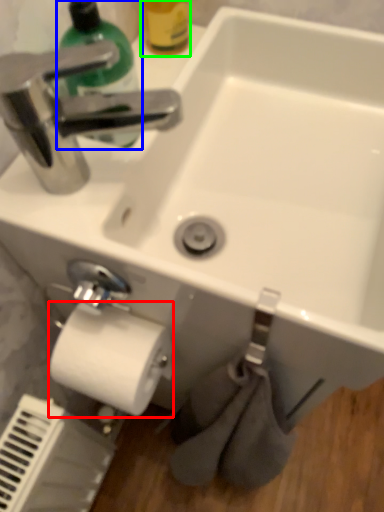
Question: Considering the real-world distances, which object is closest to toilet paper (highlighted by a red box)? cleaning product (highlighted by a blue box) or bottle (highlighted by a green box).

Choices:
 (A) cleaning product
 (B) bottle

Answer: (A)